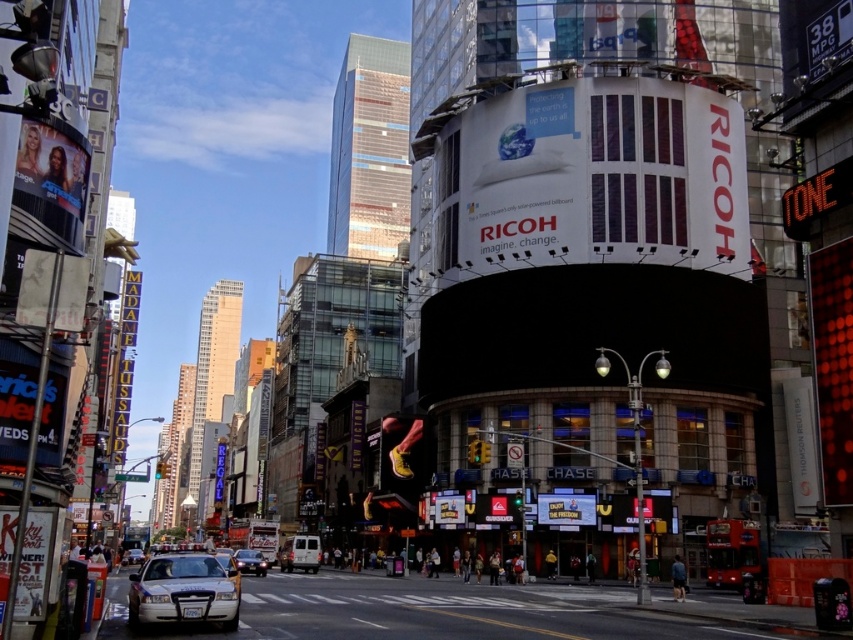
Question: In this image, where is yellow matte skateboard at center located relative to white glossy car at lower left?

Choices:
 (A) right
 (B) left

Answer: (A)

Question: Does white glossy police car at lower left come in front of yellow matte skateboard at center?

Choices:
 (A) no
 (B) yes

Answer: (B)

Question: Among these objects, which one is farthest from the camera?

Choices:
 (A) white glossy car at lower left
 (B) white matte van at center
 (C) yellow matte skateboard at center

Answer: (A)

Question: Does yellow matte skateboard at center appear on the left side of white glossy car at lower left?

Choices:
 (A) no
 (B) yes

Answer: (A)

Question: Which of the following is the closest to the observer?

Choices:
 (A) white glossy car at lower left
 (B) white matte van at center
 (C) yellow matte skateboard at center
 (D) white glossy car at center

Answer: (D)

Question: Considering the real-world distances, which object is farthest from the white glossy car at lower left?

Choices:
 (A) white glossy police car at lower left
 (B) yellow matte skateboard at center
 (C) white glossy car at center

Answer: (A)